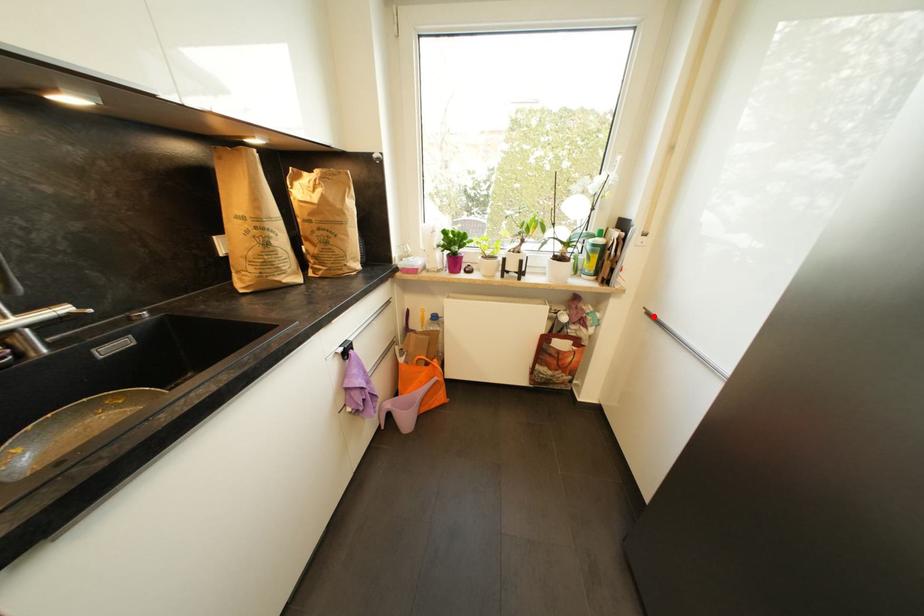
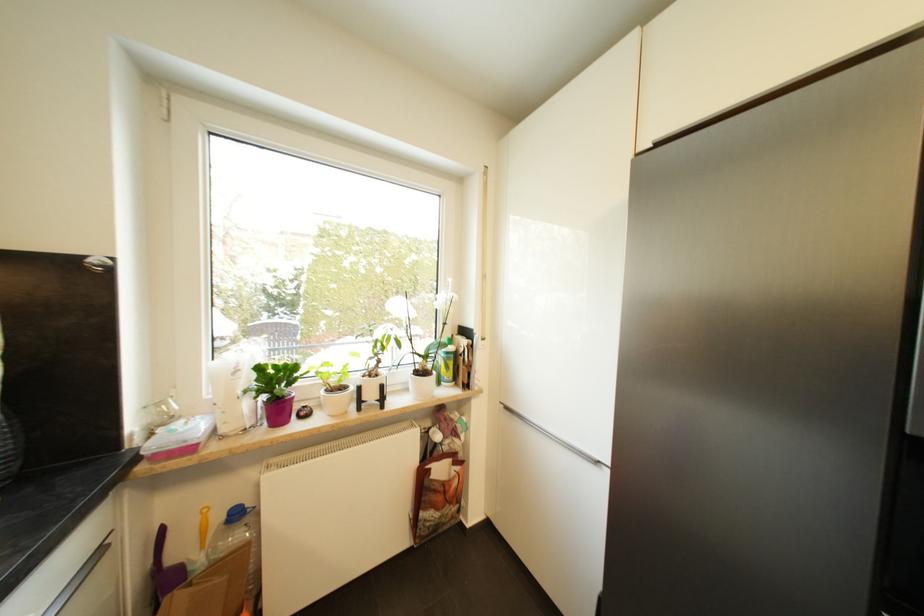
Where in the second image is the point corresponding to the highlighted location from the first image?

(512, 410)